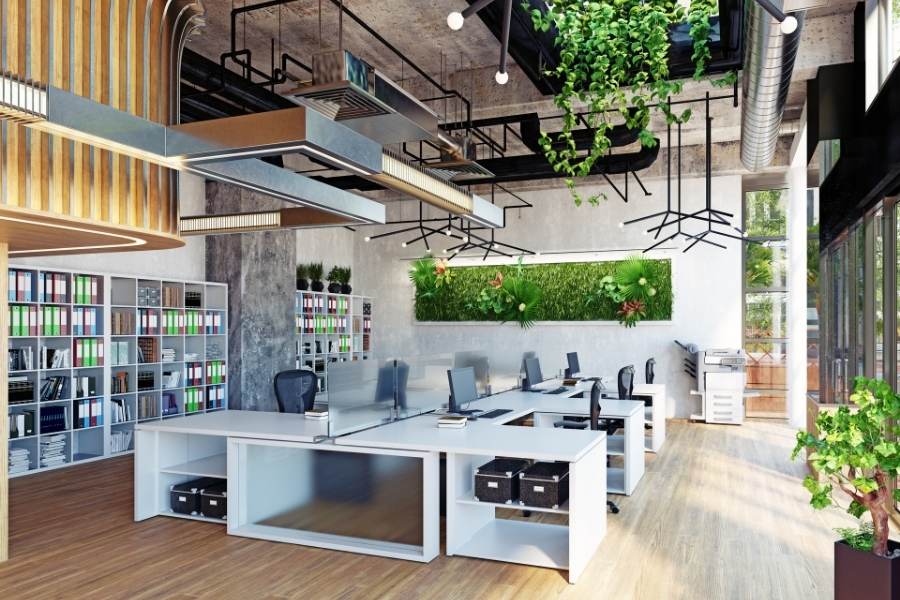
You are a GUI agent. You are given a task and a screenshot of the screen. Output one action in this format:
    pyautogui.click(x=<x>, y=<y>)
    Task: Click on the boxes
    The image size is (900, 600).
    Given the screenshot: What is the action you would take?
    click(x=192, y=491), click(x=212, y=497), click(x=478, y=474), click(x=535, y=487)